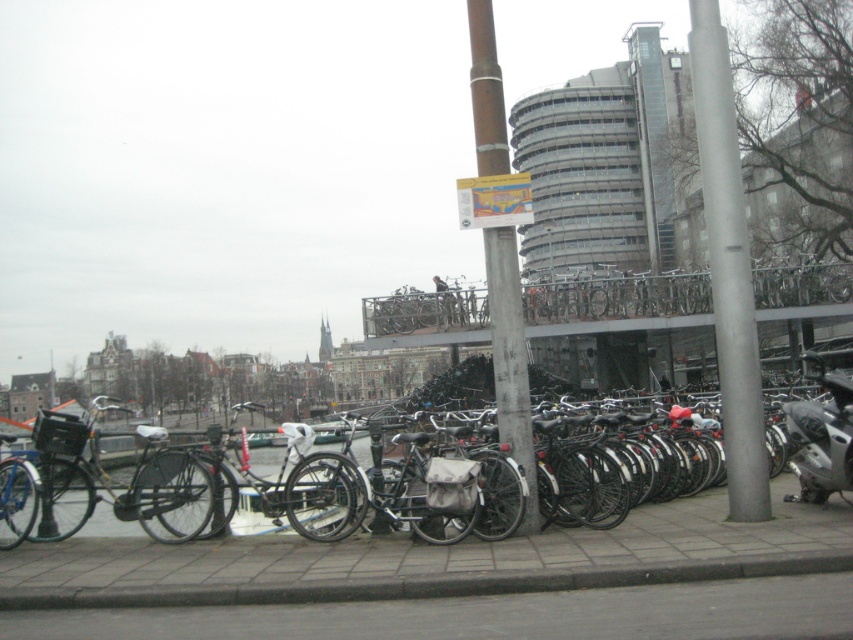
Who is positioned more to the right, matte black bicycle at left or silver metallic motorcycle at right?

Positioned to the right is silver metallic motorcycle at right.

Is matte black bicycle at left shorter than silver metallic motorcycle at right?

No.

Locate an element on the screen. This screenshot has width=853, height=640. matte black bicycle at left is located at coordinates (120, 484).

Does point (291, 602) come closer to viewer compared to point (518, 387)?

Yes, point (291, 602) is in front of point (518, 387).

Can you confirm if concrete pavement at center is shorter than brown wooden pole at center?

Yes.

Who is more distant from viewer, (619,531) or (526,426)?

Point (526,426)

You are a GUI agent. You are given a task and a screenshot of the screen. Output one action in this format:
    pyautogui.click(x=<x>, y=<y>)
    Task: Click on the concrete pavement at center
    
    Given the screenshot: What is the action you would take?
    pyautogui.click(x=456, y=580)

Does point (119, 504) come in front of point (88, 522)?

Yes, point (119, 504) is closer to viewer.

Can you confirm if matte black bicycle at left is positioned below matte black bicycle at center?

Yes, matte black bicycle at left is below matte black bicycle at center.

Measure the distance between point (41, 515) and camera.

The distance of point (41, 515) from camera is 28.45 feet.

Image resolution: width=853 pixels, height=640 pixels. In order to click on matte black bicycle at left in this screenshot , I will do `click(120, 484)`.